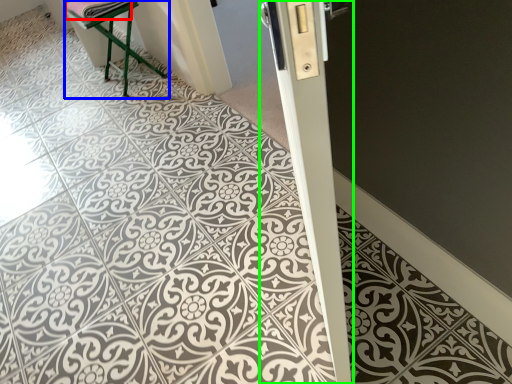
Question: Which object is positioned farthest from material (highlighted by a red box)? Select from furniture (highlighted by a blue box) and pillar (highlighted by a green box).

Choices:
 (A) furniture
 (B) pillar

Answer: (B)